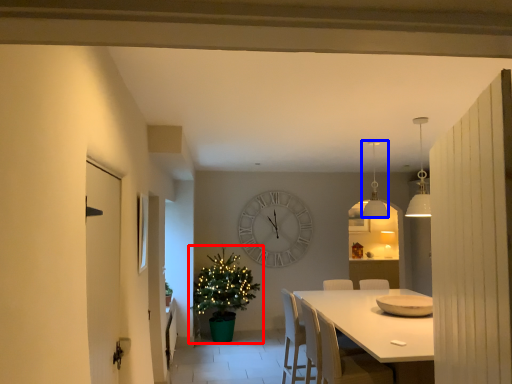
Question: Which point is further to the camera, christmas tree (highlighted by a red box) or lamp (highlighted by a blue box)?

Choices:
 (A) christmas tree
 (B) lamp

Answer: (A)